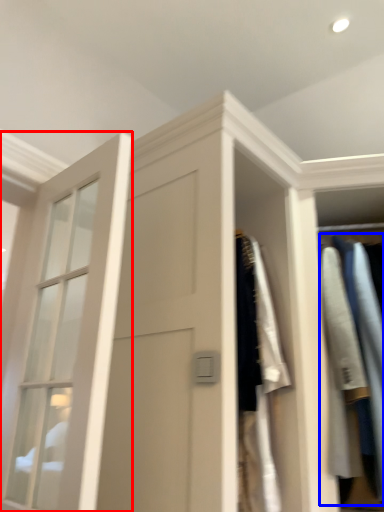
Question: Which object is closer to the camera taking this photo, window (highlighted by a red box) or clothing (highlighted by a blue box)?

Choices:
 (A) window
 (B) clothing

Answer: (A)